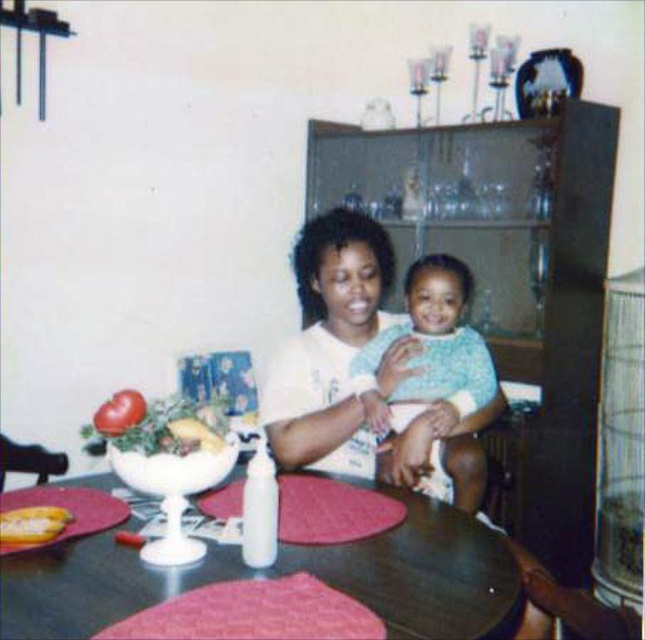
You are a guest at this dinner table and you want to place a small napkin on the table. Which object, the white matte shirt at center or the yellow matte banana at lower left, would you choose to place the napkin under based on their size?

The white matte shirt at center is bigger than the yellow matte banana at lower left, so you should place the napkin under the white matte shirt at center.

You are standing in the kitchen and want to grab the yellow matte banana at lower left from the dark wood table at center. Can you reach it without moving the table?

The dark wood table at center is closer to the viewer than the yellow matte banana at lower left, so you can reach the yellow matte banana at lower left without moving the table since it is within your reach.

You are standing at the edge of the dining table and want to reach both the point at coordinates point (470, 504) and point (6, 513). Which point will you reach first?

You will reach point (470, 504) first because it is closer to you than point (6, 513), which is further away.